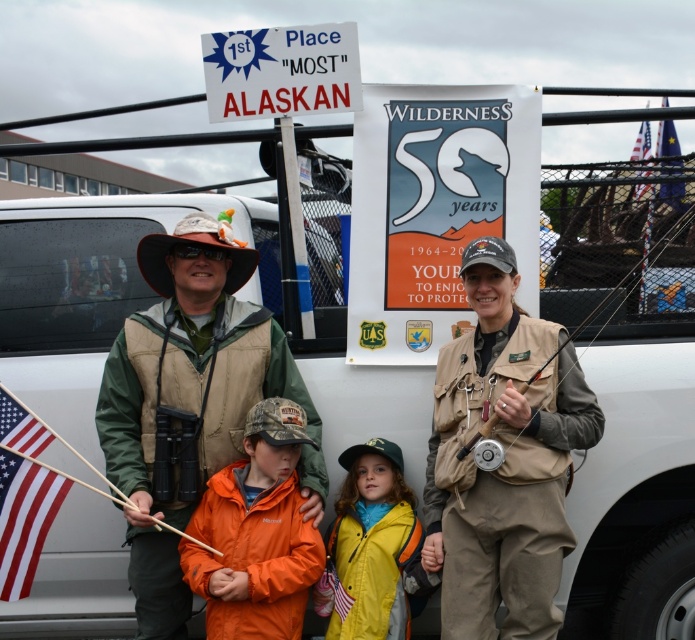
Question: Based on their relative distances, which object is farther from the white matte van at center?

Choices:
 (A) green fabric vest at left
 (B) tan fabric vest at center
 (C) orange softshell jacket at center

Answer: (B)

Question: Which of the following is the closest to the observer?

Choices:
 (A) blue fabric flag at upper right
 (B) white matte van at center
 (C) green fabric vest at left

Answer: (C)

Question: Does orange softshell jacket at center appear on the right side of american flag at upper right?

Choices:
 (A) no
 (B) yes

Answer: (A)

Question: Does white matte van at center appear on the left side of american flag at left?

Choices:
 (A) yes
 (B) no

Answer: (B)

Question: Among these objects, which one is nearest to the camera?

Choices:
 (A) yellow matte jacket at center
 (B) white matte van at center
 (C) tan fabric vest at center
 (D) metallic plastic sign at upper center

Answer: (C)

Question: Observing the image, what is the correct spatial positioning of orange softshell jacket at center in reference to american flag at left?

Choices:
 (A) below
 (B) above

Answer: (A)